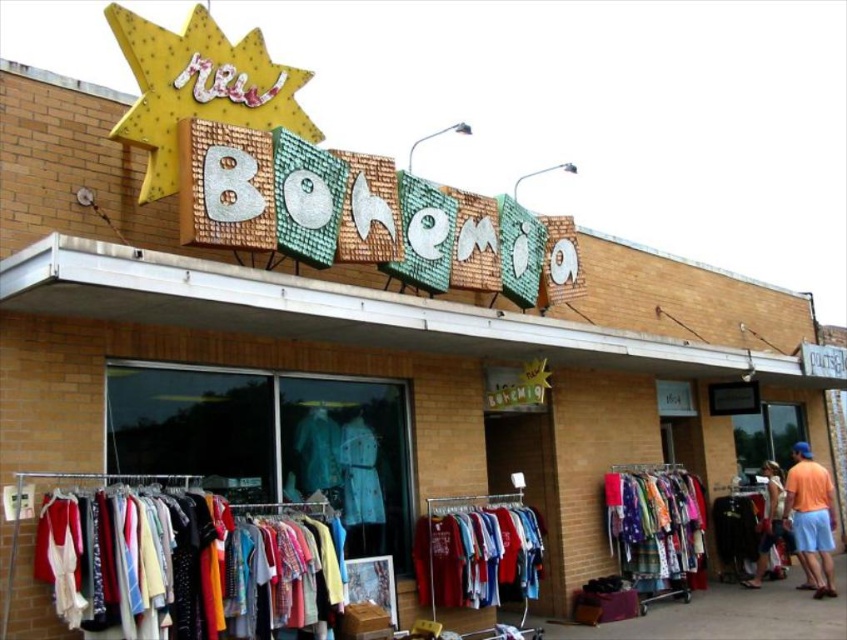
Question: Is multicolored fabric shirts at center to the left of matte black dress at center from the viewer's perspective?

Choices:
 (A) yes
 (B) no

Answer: (A)

Question: Which point is closer to the camera taking this photo?

Choices:
 (A) (792, 472)
 (B) (677, 465)
 (C) (490, 518)

Answer: (C)

Question: Does multicolored fabric shirts at center have a greater width compared to white cotton dress at lower right?

Choices:
 (A) no
 (B) yes

Answer: (B)

Question: Is multicolored fabric at lower left closer to camera compared to white cotton dress at lower right?

Choices:
 (A) no
 (B) yes

Answer: (B)

Question: Which of the following is the closest to the observer?

Choices:
 (A) (731, 522)
 (B) (104, 515)
 (C) (435, 525)
 (D) (651, 568)

Answer: (B)

Question: Which of the following is the closest to the observer?

Choices:
 (A) (346, 499)
 (B) (759, 557)
 (C) (305, 416)

Answer: (C)